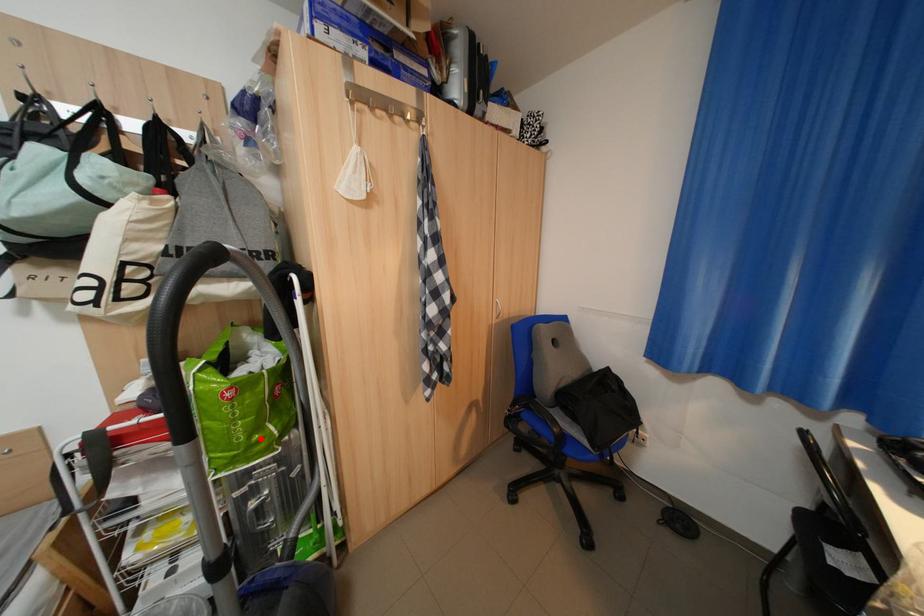
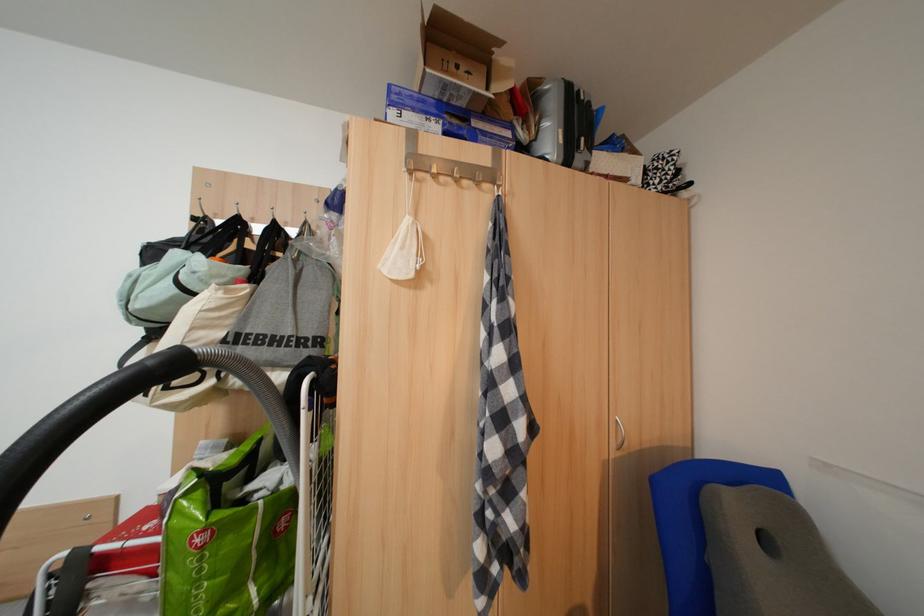
Find the pixel in the second image that matches the highlighted location in the first image.

(225, 610)